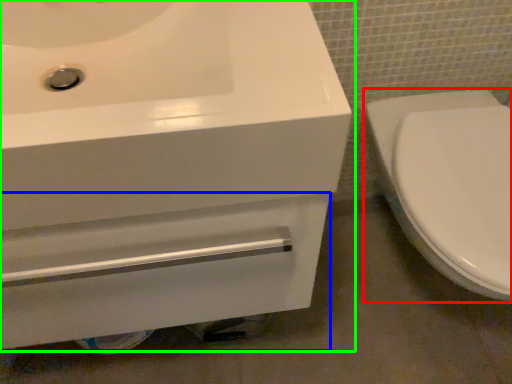
Question: Which is farther away from toilet (highlighted by a red box)? drawer (highlighted by a blue box) or sink (highlighted by a green box)?

Choices:
 (A) drawer
 (B) sink

Answer: (B)